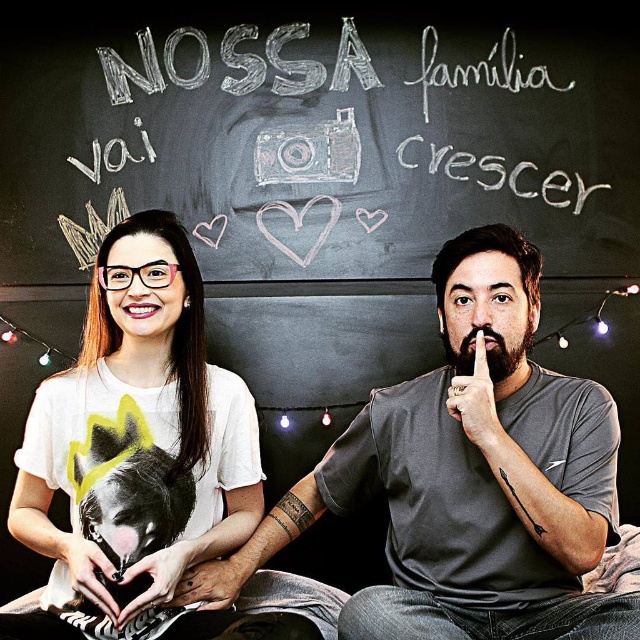
Question: Does gray matte t-shirt at center have a greater width compared to white matte t-shirt at left?

Choices:
 (A) no
 (B) yes

Answer: (B)

Question: Is black chalkboard at upper center further to camera compared to white matte t-shirt at left?

Choices:
 (A) no
 (B) yes

Answer: (B)

Question: Is gray matte t-shirt at center thinner than white matte t-shirt at left?

Choices:
 (A) no
 (B) yes

Answer: (A)

Question: Among these objects, which one is farthest from the camera?

Choices:
 (A) black chalkboard at upper center
 (B) gray matte t-shirt at center
 (C) white matte t-shirt at left

Answer: (A)

Question: Estimate the real-world distances between objects in this image. Which object is farther from the black chalkboard at upper center?

Choices:
 (A) gray matte t-shirt at center
 (B) white matte t-shirt at left

Answer: (A)

Question: Which object is farther from the camera taking this photo?

Choices:
 (A) black chalkboard at upper center
 (B) white matte t-shirt at left

Answer: (A)